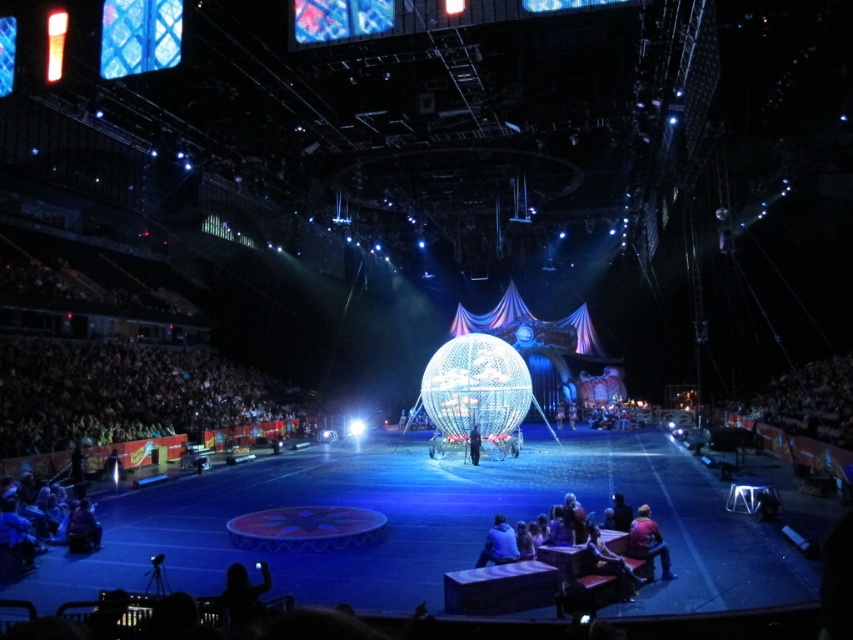
Question: Which point is farther to the camera?

Choices:
 (A) leather jacket at lower right
 (B) blue denim jeans at lower left

Answer: (B)

Question: Can you confirm if dark blue fabric at lower right is thinner than leather jacket at lower right?

Choices:
 (A) yes
 (B) no

Answer: (B)

Question: Which object appears farthest from the camera in this image?

Choices:
 (A) dark blue fabric crowd at lower left
 (B) red fabric jacket at lower right
 (C) blue denim jeans at lower left

Answer: (A)

Question: Is dark blue fabric crowd at lower left smaller than light blue fabric jacket at lower center?

Choices:
 (A) yes
 (B) no

Answer: (B)

Question: Based on their relative distances, which object is farther from the dark blue fabric crowd at lower left?

Choices:
 (A) light blue fabric jacket at lower center
 (B) red fabric jacket at lower right
 (C) dark blue fabric at lower right

Answer: (B)

Question: Does blue denim jeans at lower left have a larger size compared to dark blue fabric person at center?

Choices:
 (A) no
 (B) yes

Answer: (B)